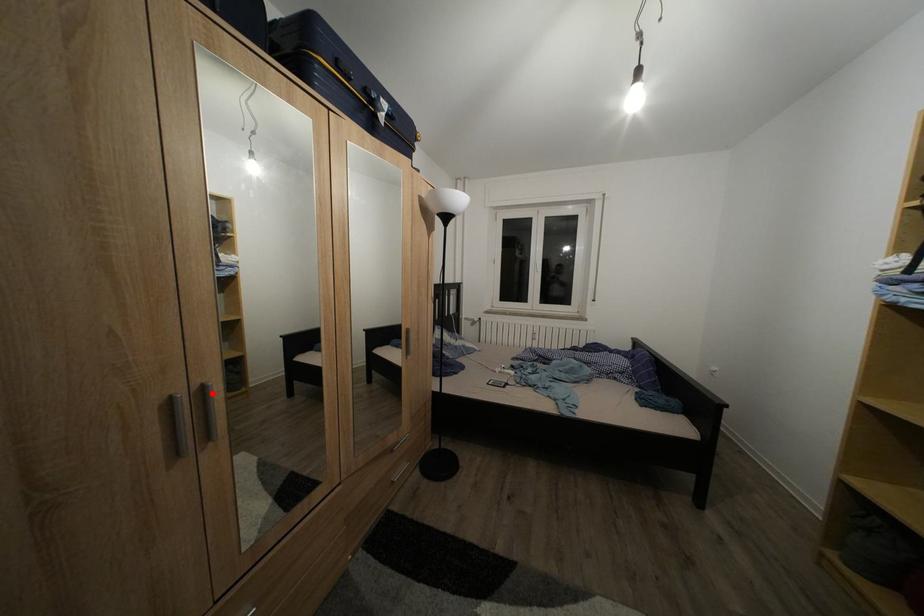
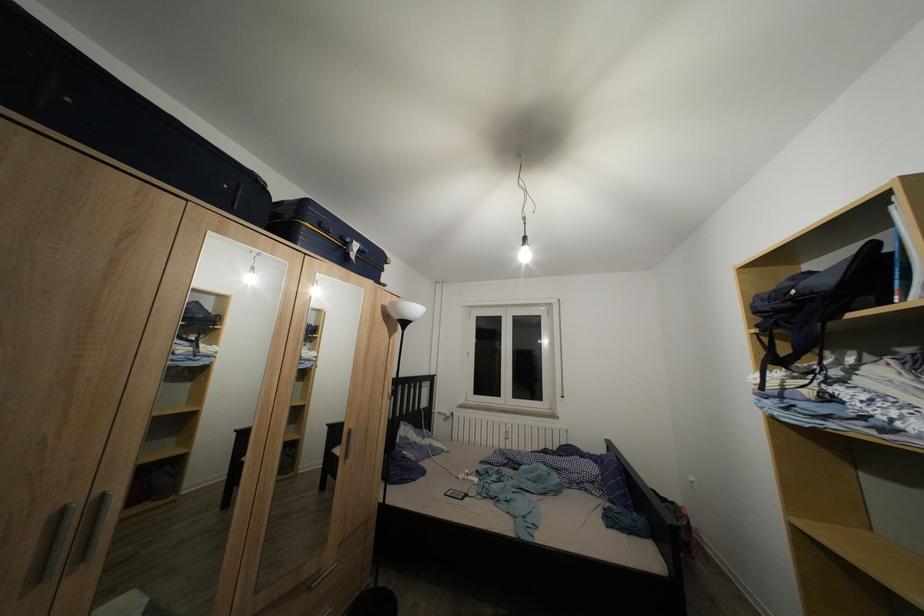
Question: I am providing you with two images of the same scene from different viewpoints. A red point is marked on the first image. Is the red point's position out of view in image 2?

Choices:
 (A) Yes
 (B) No

Answer: (B)